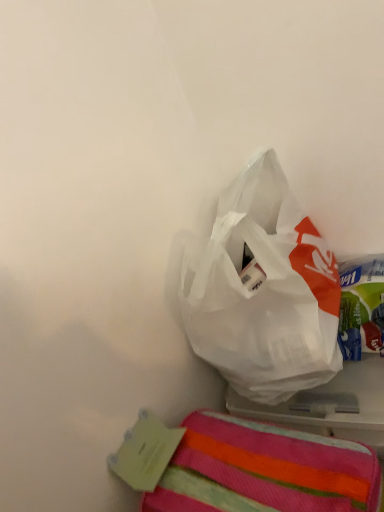
What do you see at coordinates (264, 470) in the screenshot? I see `striped cotton towel at lower right` at bounding box center [264, 470].

Identify the location of striped cotton towel at lower right. This screenshot has width=384, height=512. (264, 470).

From the picture: In order to face transparent plastic bag at upper center, should I rotate leftwards or rightwards?

Rotate right and turn 10.926 degrees.

This screenshot has height=512, width=384. Identify the location of transparent plastic bag at upper center. (262, 290).

Image resolution: width=384 pixels, height=512 pixels. Describe the element at coordinates (262, 290) in the screenshot. I see `transparent plastic bag at upper center` at that location.

This screenshot has width=384, height=512. Identify the location of striped cotton towel at lower right. (264, 470).

Considering the relative positions of transparent plastic bag at upper center and striped cotton towel at lower right in the image provided, is transparent plastic bag at upper center to the left of striped cotton towel at lower right from the viewer's perspective?

No.

Does transparent plastic bag at upper center lie in front of striped cotton towel at lower right?

No, it is behind striped cotton towel at lower right.

Considering the points (295, 325) and (234, 447), which point is in front, point (295, 325) or point (234, 447)?

Point (234, 447)

From the picture: From the image's perspective, is transparent plastic bag at upper center under striped cotton towel at lower right?

No, from the image's perspective, transparent plastic bag at upper center is not below striped cotton towel at lower right.

From a real-world perspective, between transparent plastic bag at upper center and striped cotton towel at lower right, who is vertically higher?

In real-world perspective, transparent plastic bag at upper center is above.

Does transparent plastic bag at upper center have a lesser width compared to striped cotton towel at lower right?

Correct, the width of transparent plastic bag at upper center is less than that of striped cotton towel at lower right.

Considering the sizes of objects transparent plastic bag at upper center and striped cotton towel at lower right in the image provided, who is shorter, transparent plastic bag at upper center or striped cotton towel at lower right?

With less height is striped cotton towel at lower right.

From the picture: Can you confirm if transparent plastic bag at upper center is bigger than striped cotton towel at lower right?

Yes.

Is transparent plastic bag at upper center not within striped cotton towel at lower right?

Yes.

Is transparent plastic bag at upper center beside striped cotton towel at lower right?

No, transparent plastic bag at upper center is not touching striped cotton towel at lower right.

Is transparent plastic bag at upper center positioned with its back to striped cotton towel at lower right?

No.

Can you tell me how much transparent plastic bag at upper center and striped cotton towel at lower right differ in facing direction?

The facing directions of transparent plastic bag at upper center and striped cotton towel at lower right are 0.000362 degrees apart.

The image size is (384, 512). What are the coordinates of `plastic bag positioned vertically above the striped cotton towel at lower right (from a real-world perspective)` in the screenshot? It's located at (262, 290).

Is striped cotton towel at lower right at the right side of transparent plastic bag at upper center?

In fact, striped cotton towel at lower right is to the left of transparent plastic bag at upper center.

In the image, is striped cotton towel at lower right positioned in front of or behind transparent plastic bag at upper center?

Visually, striped cotton towel at lower right is located in front of transparent plastic bag at upper center.

Does point (327, 494) lie behind point (241, 346)?

That is False.

From the image's perspective, which object appears higher, striped cotton towel at lower right or transparent plastic bag at upper center?

transparent plastic bag at upper center.

From a real-world perspective, is striped cotton towel at lower right physically below transparent plastic bag at upper center?

Yes, from a real-world perspective, striped cotton towel at lower right is under transparent plastic bag at upper center.

Considering the sizes of objects striped cotton towel at lower right and transparent plastic bag at upper center in the image provided, who is thinner, striped cotton towel at lower right or transparent plastic bag at upper center?

With smaller width is transparent plastic bag at upper center.

Does striped cotton towel at lower right have a lesser height compared to transparent plastic bag at upper center?

Yes.

Considering the sizes of objects striped cotton towel at lower right and transparent plastic bag at upper center in the image provided, who is bigger, striped cotton towel at lower right or transparent plastic bag at upper center?

transparent plastic bag at upper center.

Is striped cotton towel at lower right surrounding transparent plastic bag at upper center?

No, transparent plastic bag at upper center is located outside of striped cotton towel at lower right.

Is striped cotton towel at lower right next to transparent plastic bag at upper center?

No, striped cotton towel at lower right is not in contact with transparent plastic bag at upper center.

Is striped cotton towel at lower right facing towards transparent plastic bag at upper center?

No, striped cotton towel at lower right is not oriented towards transparent plastic bag at upper center.

Measure the distance from striped cotton towel at lower right to transparent plastic bag at upper center.

striped cotton towel at lower right and transparent plastic bag at upper center are 8.03 inches apart.

I want to click on plastic bag behind the striped cotton towel at lower right, so click(x=262, y=290).

Where is `plastic bag above the striped cotton towel at lower right (from the image's perspective)`? The width and height of the screenshot is (384, 512). plastic bag above the striped cotton towel at lower right (from the image's perspective) is located at coordinates (262, 290).

This screenshot has height=512, width=384. In order to click on plastic bag above the striped cotton towel at lower right (from a real-world perspective) in this screenshot , I will do `click(262, 290)`.